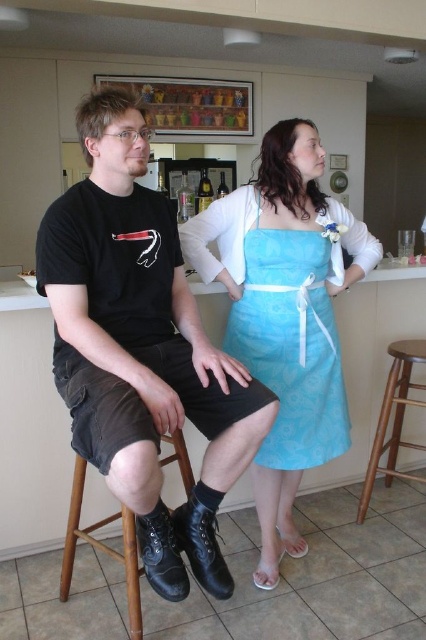
Please look at the image and determine the exact coordinates of the blue fabric dress at center in the 2D space. The coordinate system is defined with the origin at the bottom left corner of the image, where the x and y axes increase to the right and upwards respectively. The values are normalized between 0 and 1. What are the coordinates?

The blue fabric dress at center is located at coordinates x 0.492 and y 0.671.

You are arranging a photo shoot and need to position a model wearing the blue fabric dress at center so that they are not directly in front of the black leather stool at lower left. Based on the scene description, which direction should the model move to achieve this?

The blue fabric dress at center is currently to the right of the black leather stool at lower left. To avoid being directly in front of the stool, the model should move to the left side of the stool.

You are a delivery person who needs to place a small package on the floor near the black leather boots at center. According to the image, where should you place the package in terms of coordinates?

The black leather boots at center are located at coordinates point (141, 348), so you should place the package near that point.